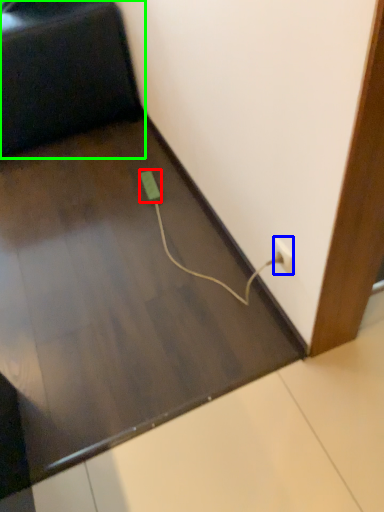
Question: Based on their relative distances, which object is farther from socket (highlighted by a red box)? Choose from power plugs and sockets (highlighted by a blue box) and furniture (highlighted by a green box).

Choices:
 (A) power plugs and sockets
 (B) furniture

Answer: (A)